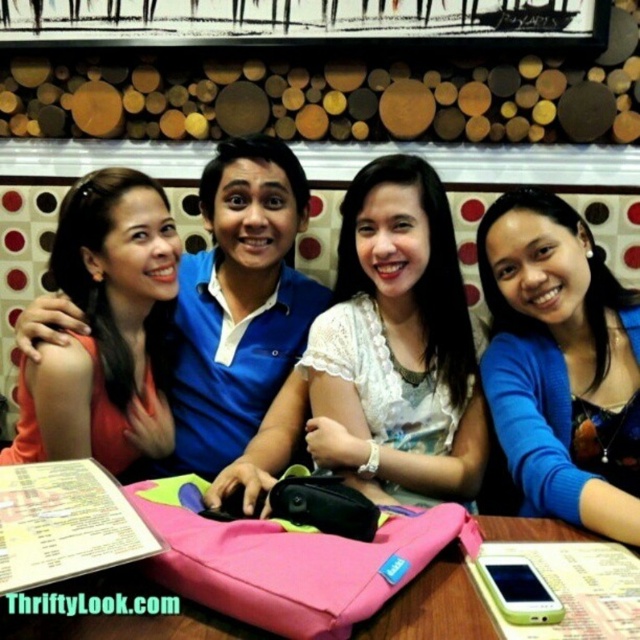
You are a photographer setting up for a group photo at a cozy restaurant. You notice the blue matte sweater at center and the pink fabric table at center. Which object should you focus on first if you want to capture the larger object in your shot?

The blue matte sweater at center is bigger than the pink fabric table at center, so you should focus on the blue matte sweater at center first to capture the larger object.

You are a photographer trying to capture a group photo of the white lace blouse at center and the pink fabric table at center. Which object should you position to your left to ensure both are in the frame?

You should position the pink fabric table at center to your left since the white lace blouse at center is to the right of it, ensuring both are included in the frame.